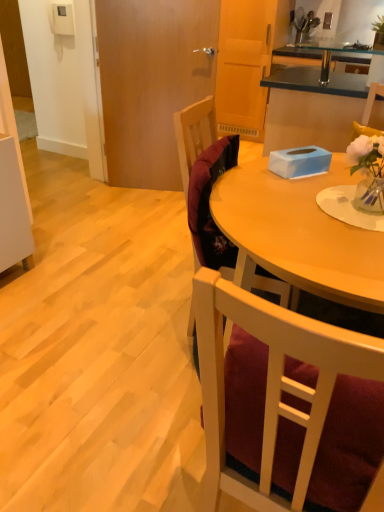
Question: Does velvet burgundy chair at center, which ranks as the 1th chair in back-to-front order, lie behind velvet burgundy chair at center, the 1th chair when ordered from front to back?

Choices:
 (A) no
 (B) yes

Answer: (B)

Question: From a real-world perspective, is velvet burgundy chair at center, which ranks as the 1th chair in back-to-front order, below velvet burgundy chair at center, the 1th chair when ordered from front to back?

Choices:
 (A) yes
 (B) no

Answer: (B)

Question: Does velvet burgundy chair at center, which ranks as the 1th chair in back-to-front order, have a larger size compared to velvet burgundy chair at center, the 1th chair when ordered from front to back?

Choices:
 (A) no
 (B) yes

Answer: (A)

Question: From the image's perspective, is velvet burgundy chair at center, which ranks as the 1th chair in back-to-front order, on top of velvet burgundy chair at center, the second chair viewed from the back?

Choices:
 (A) no
 (B) yes

Answer: (B)

Question: Can you confirm if velvet burgundy chair at center, which ranks as the 1th chair in back-to-front order, is smaller than velvet burgundy chair at center, the second chair viewed from the back?

Choices:
 (A) no
 (B) yes

Answer: (B)

Question: Is velvet burgundy chair at center, the 2th chair when ordered from front to back, not near velvet burgundy chair at center, the second chair viewed from the back?

Choices:
 (A) no
 (B) yes

Answer: (A)

Question: Could you tell me if velvet burgundy chair at center, the second chair viewed from the back, is turned towards velvet burgundy chair at center, the 2th chair when ordered from front to back?

Choices:
 (A) no
 (B) yes

Answer: (A)

Question: Is velvet burgundy chair at center, the second chair viewed from the back, at the right side of velvet burgundy chair at center, the 2th chair when ordered from front to back?

Choices:
 (A) no
 (B) yes

Answer: (B)

Question: From a real-world perspective, is velvet burgundy chair at center, the 1th chair when ordered from front to back, positioned under velvet burgundy chair at center, which ranks as the 1th chair in back-to-front order, based on gravity?

Choices:
 (A) no
 (B) yes

Answer: (B)

Question: From a real-world perspective, does velvet burgundy chair at center, the 1th chair when ordered from front to back, stand above velvet burgundy chair at center, which ranks as the 1th chair in back-to-front order?

Choices:
 (A) no
 (B) yes

Answer: (A)

Question: Is velvet burgundy chair at center, the 1th chair when ordered from front to back, in front of velvet burgundy chair at center, the 2th chair when ordered from front to back?

Choices:
 (A) no
 (B) yes

Answer: (B)

Question: Is velvet burgundy chair at center, the 1th chair when ordered from front to back, positioned behind velvet burgundy chair at center, the 2th chair when ordered from front to back?

Choices:
 (A) yes
 (B) no

Answer: (B)

Question: Does velvet burgundy chair at center, the second chair viewed from the back, have a greater height compared to blue matte tissue box at center?

Choices:
 (A) no
 (B) yes

Answer: (B)